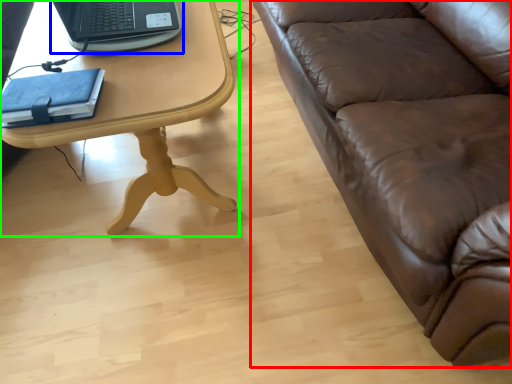
Question: Considering the real-world distances, which object is farthest from studio couch (highlighted by a red box)? laptop (highlighted by a blue box) or table (highlighted by a green box)?

Choices:
 (A) laptop
 (B) table

Answer: (A)